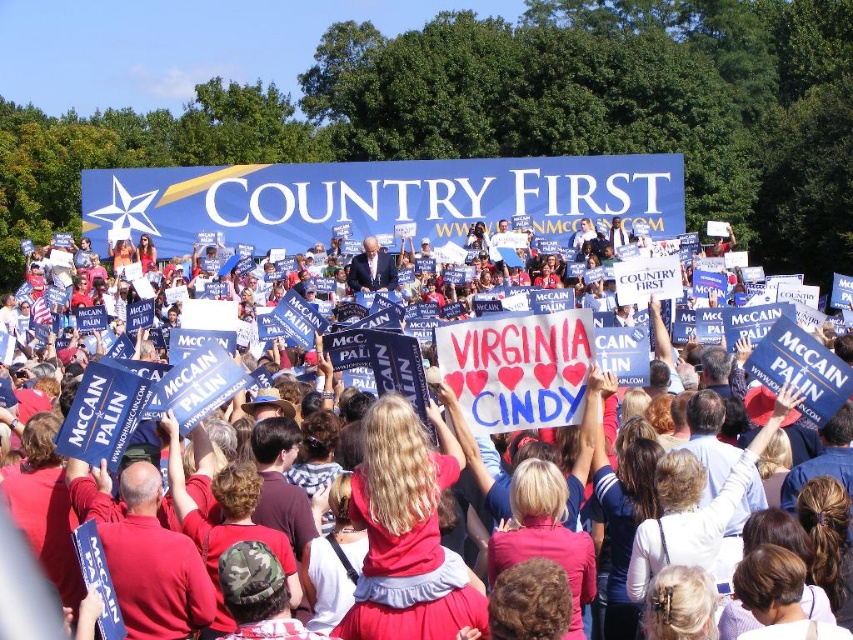
Question: In this image, where is red fabric crowd at center located relative to blue fabric suit at center?

Choices:
 (A) left
 (B) right

Answer: (B)

Question: Among these objects, which one is farthest from the camera?

Choices:
 (A) red fabric crowd at center
 (B) blue fabric suit at center

Answer: (B)

Question: Is red fabric crowd at center bigger than blue fabric suit at center?

Choices:
 (A) yes
 (B) no

Answer: (A)

Question: Which object appears farthest from the camera in this image?

Choices:
 (A) red fabric crowd at center
 (B) blue fabric suit at center

Answer: (B)

Question: Where is red fabric crowd at center located in relation to blue fabric suit at center in the image?

Choices:
 (A) right
 (B) left

Answer: (A)